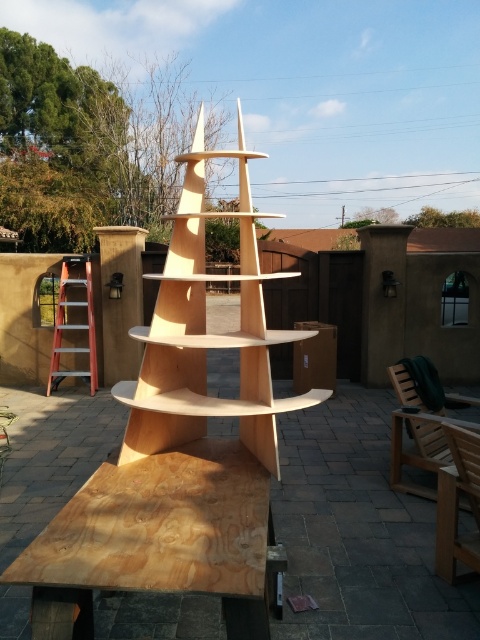
Question: Which of the following is the closest to the observer?

Choices:
 (A) orange metallic ladder at left
 (B) plywood picnic table at lower left

Answer: (B)

Question: Among these objects, which one is farthest from the camera?

Choices:
 (A) orange metallic ladder at left
 (B) plywood picnic table at lower left
 (C) natural wood shelf at center

Answer: (A)

Question: Which object is the farthest from the natural wood shelf at center?

Choices:
 (A) orange metallic ladder at left
 (B) plywood picnic table at lower left

Answer: (A)

Question: Is natural wood shelf at center thinner than orange metallic ladder at left?

Choices:
 (A) yes
 (B) no

Answer: (B)

Question: Does natural wood shelf at center have a greater width compared to orange metallic ladder at left?

Choices:
 (A) yes
 (B) no

Answer: (A)

Question: Is natural wood shelf at center below orange metallic ladder at left?

Choices:
 (A) yes
 (B) no

Answer: (B)